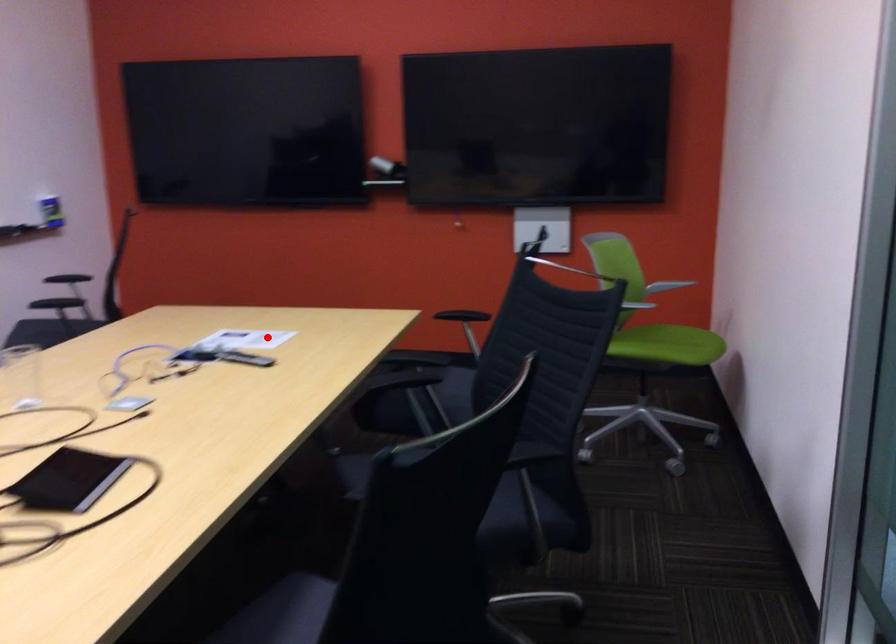
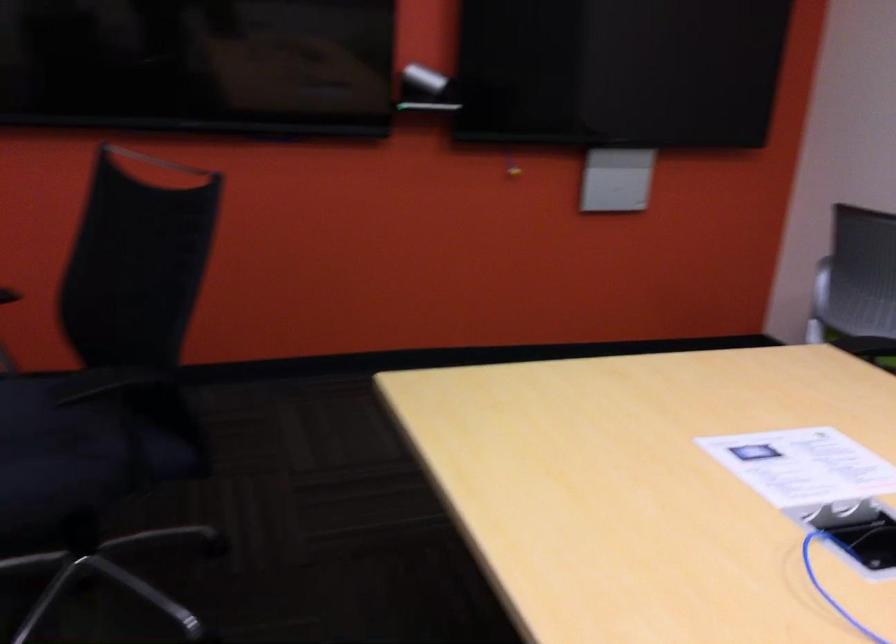
Question: I am providing you with two images of the same scene from different viewpoints. A red point is shown in image1. For the corresponding object point in image2, is it positioned nearer or farther from the camera?

Choices:
 (A) Nearer
 (B) Farther

Answer: (A)